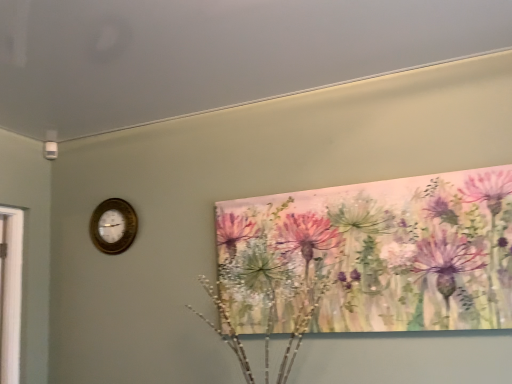
In order to face watercolor flowers at upper right, should I rotate leftwards or rightwards?

A 13.185 degree turn to the right will do.

You are a GUI agent. You are given a task and a screenshot of the screen. Output one action in this format:
    pyautogui.click(x=<x>, y=<y>)
    Task: Click on the watercolor flowers at upper right
    The image size is (512, 384).
    Given the screenshot: What is the action you would take?
    click(372, 255)

Describe the element at coordinates (372, 255) in the screenshot. I see `watercolor flowers at upper right` at that location.

What do you see at coordinates (113, 226) in the screenshot?
I see `gold metallic wall clock at left` at bounding box center [113, 226].

Where is `gold metallic wall clock at left`? Image resolution: width=512 pixels, height=384 pixels. gold metallic wall clock at left is located at coordinates (113, 226).

What are the coordinates of `watercolor flowers at upper right` in the screenshot? It's located at (372, 255).

Does watercolor flowers at upper right appear on the right side of gold metallic wall clock at left?

Yes.

Considering the positions of objects watercolor flowers at upper right and gold metallic wall clock at left in the image provided, who is in front, watercolor flowers at upper right or gold metallic wall clock at left?

watercolor flowers at upper right.

Considering the positions of points (305, 300) and (130, 232), is point (305, 300) farther from camera compared to point (130, 232)?

No, it is not.

Looking at this image, from the image's perspective, is watercolor flowers at upper right on gold metallic wall clock at left?

Incorrect, from the image's perspective, watercolor flowers at upper right is lower than gold metallic wall clock at left.

From a real-world perspective, who is located higher, watercolor flowers at upper right or gold metallic wall clock at left?

gold metallic wall clock at left is physically above.

Which of these two, watercolor flowers at upper right or gold metallic wall clock at left, is thinner?

With smaller width is gold metallic wall clock at left.

Which of these two, watercolor flowers at upper right or gold metallic wall clock at left, stands taller?

watercolor flowers at upper right.

Considering the relative sizes of watercolor flowers at upper right and gold metallic wall clock at left in the image provided, is watercolor flowers at upper right smaller than gold metallic wall clock at left?

Incorrect, watercolor flowers at upper right is not smaller in size than gold metallic wall clock at left.

Is watercolor flowers at upper right positioned beyond the bounds of gold metallic wall clock at left?

watercolor flowers at upper right is positioned outside gold metallic wall clock at left.

Is there a large distance between watercolor flowers at upper right and gold metallic wall clock at left?

Actually, watercolor flowers at upper right and gold metallic wall clock at left are a little close together.

Is gold metallic wall clock at left at the back of watercolor flowers at upper right?

No, watercolor flowers at upper right's orientation is not away from gold metallic wall clock at left.

Looking at this image, how different are the orientations of watercolor flowers at upper right and gold metallic wall clock at left in degrees?

They differ by 0.77 degrees in their facing directions.

Measure the distance between watercolor flowers at upper right and gold metallic wall clock at left.

watercolor flowers at upper right and gold metallic wall clock at left are 38.64 inches apart from each other.

What are the coordinates of `wall clock that appears on the left of watercolor flowers at upper right` in the screenshot? It's located at (113, 226).

Which is more to the right, gold metallic wall clock at left or watercolor flowers at upper right?

From the viewer's perspective, watercolor flowers at upper right appears more on the right side.

Is gold metallic wall clock at left further to camera compared to watercolor flowers at upper right?

Yes, gold metallic wall clock at left is further from the viewer.

Considering the points (92, 224) and (436, 195), which point is behind, point (92, 224) or point (436, 195)?

The point (92, 224) is behind.

From the image's perspective, is gold metallic wall clock at left beneath watercolor flowers at upper right?

No.

From a real-world perspective, who is located lower, gold metallic wall clock at left or watercolor flowers at upper right?

From a 3D spatial view, watercolor flowers at upper right is below.

Which of these two, gold metallic wall clock at left or watercolor flowers at upper right, is wider?

watercolor flowers at upper right is wider.

Between gold metallic wall clock at left and watercolor flowers at upper right, which one has less height?

gold metallic wall clock at left.

Who is smaller, gold metallic wall clock at left or watercolor flowers at upper right?

With smaller size is gold metallic wall clock at left.

Is watercolor flowers at upper right inside gold metallic wall clock at left?

No, gold metallic wall clock at left does not contain watercolor flowers at upper right.

Would you consider gold metallic wall clock at left to be distant from watercolor flowers at upper right?

Actually, gold metallic wall clock at left and watercolor flowers at upper right are a little close together.

Is gold metallic wall clock at left facing towards watercolor flowers at upper right?

No, gold metallic wall clock at left is not oriented towards watercolor flowers at upper right.

Locate an element on the screen. wall clock to the left of watercolor flowers at upper right is located at coordinates (113, 226).

Where is `flower to the right of gold metallic wall clock at left`? This screenshot has width=512, height=384. flower to the right of gold metallic wall clock at left is located at coordinates (372, 255).

Identify the location of flower that appears below the gold metallic wall clock at left (from the image's perspective). (372, 255).